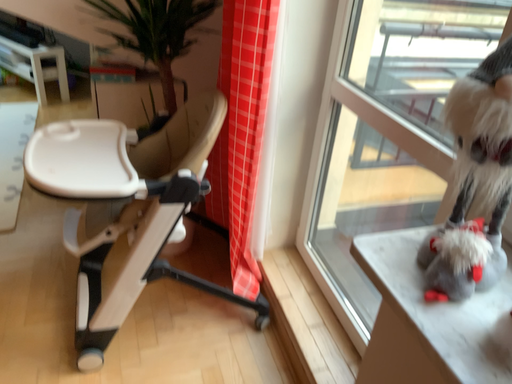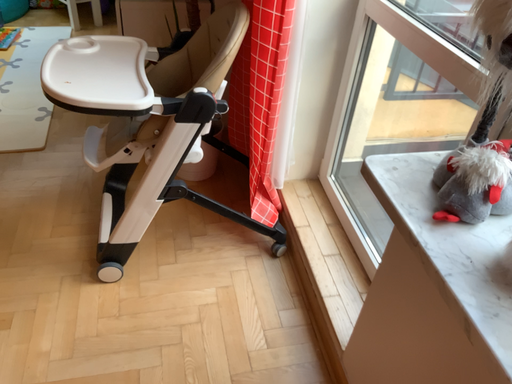
Question: Which way did the camera rotate in the video?

Choices:
 (A) rotated downward
 (B) rotated upward

Answer: (A)